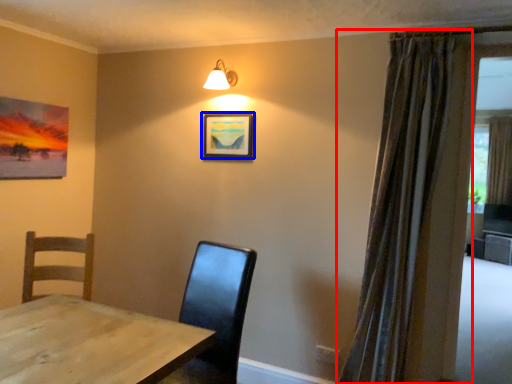
Question: Which of the following is the closest to the observer, curtain (highlighted by a red box) or picture frame (highlighted by a blue box)?

Choices:
 (A) curtain
 (B) picture frame

Answer: (A)